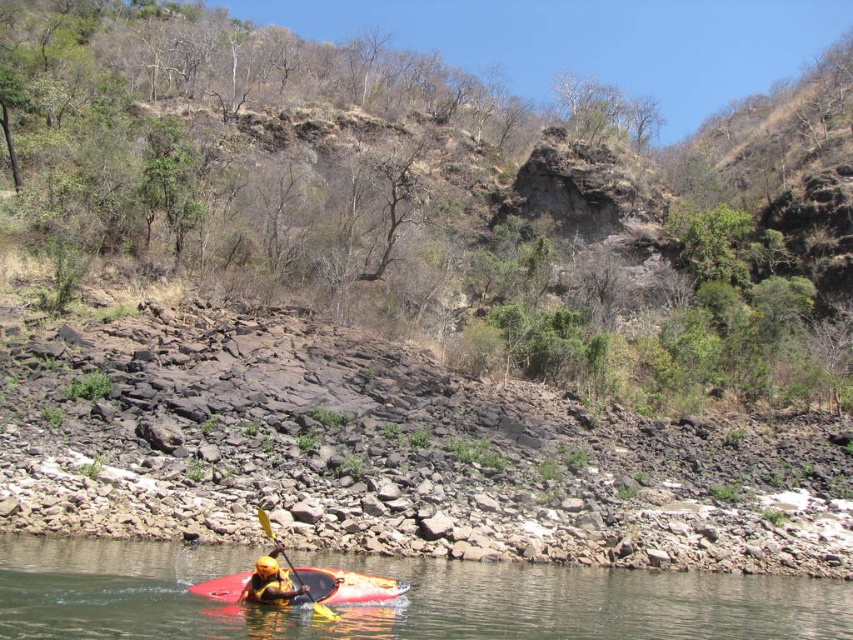
Question: Can you confirm if rubber kayak at lower center is wider than yellow plastic paddle at lower center?

Choices:
 (A) no
 (B) yes

Answer: (B)

Question: Can you confirm if matte red kayak at lower center is smaller than yellow matte helmet at lower center?

Choices:
 (A) no
 (B) yes

Answer: (A)

Question: Does rubber kayak at lower center have a greater width compared to matte red kayak at lower center?

Choices:
 (A) no
 (B) yes

Answer: (B)

Question: Considering the real-world distances, which object is farthest from the rocky at lower center?

Choices:
 (A) matte red kayak at lower center
 (B) rubber kayak at lower center

Answer: (A)

Question: Which object is closer to the camera taking this photo?

Choices:
 (A) yellow plastic paddle at lower center
 (B) matte red kayak at lower center

Answer: (A)

Question: Estimate the real-world distances between objects in this image. Which object is farther from the yellow plastic paddle at lower center?

Choices:
 (A) matte red kayak at lower center
 (B) yellow matte helmet at lower center
 (C) rocky at lower center
 (D) rubber kayak at lower center

Answer: (C)